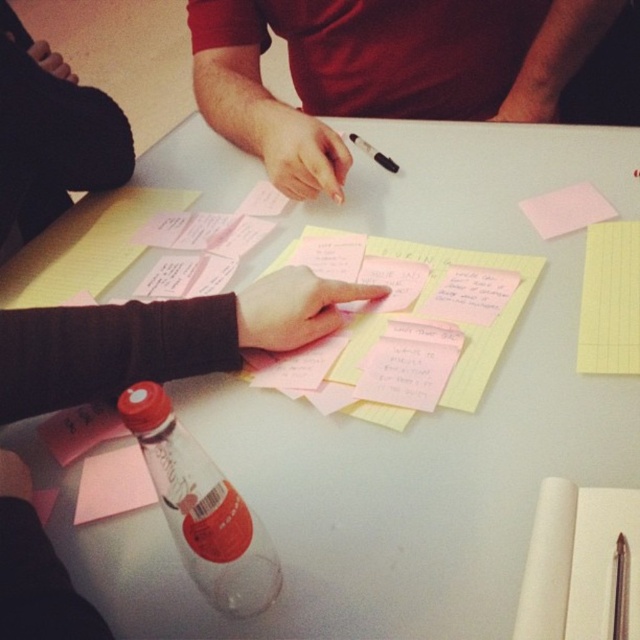
Does pink paper at center appear over black glossy pen at center?

No.

Which is more to the right, pink paper at center or black glossy pen at center?

black glossy pen at center is more to the right.

Locate an element on the screen. pink paper at center is located at coordinates (467, 323).

Between clear plastic bottle at lower left and pink paper at lower left, which one has more height?

With more height is clear plastic bottle at lower left.

Who is positioned more to the left, clear plastic bottle at lower left or pink paper at lower left?

From the viewer's perspective, pink paper at lower left appears more on the left side.

Is point (0, 358) closer to camera compared to point (124, 464)?

Yes, it is in front of point (124, 464).

The image size is (640, 640). I want to click on clear plastic bottle at lower left, so click(157, 339).

Which is in front, point (474, 385) or point (129, 458)?

Point (474, 385) is in front.

Between point (508, 262) and point (115, 492), which one is positioned in front?

Point (115, 492) is more forward.

The width and height of the screenshot is (640, 640). I want to click on pink paper at center, so click(467, 323).